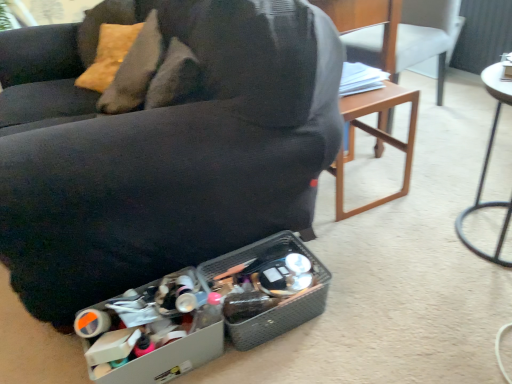
Question: Does metallic silver table at right come behind wooden chair at right, which is counted as the second chair, starting from the left?

Choices:
 (A) yes
 (B) no

Answer: (B)

Question: Is metallic silver table at right not close to wooden chair at right, positioned as the first chair in right-to-left order?

Choices:
 (A) no
 (B) yes

Answer: (A)

Question: Is the depth of metallic silver table at right less than that of wooden chair at right, which is counted as the second chair, starting from the left?

Choices:
 (A) yes
 (B) no

Answer: (A)

Question: Is metallic silver table at right thinner than wooden chair at right, positioned as the first chair in right-to-left order?

Choices:
 (A) no
 (B) yes

Answer: (B)

Question: Does metallic silver table at right have a lesser height compared to wooden chair at right, positioned as the first chair in right-to-left order?

Choices:
 (A) no
 (B) yes

Answer: (B)

Question: From a real-world perspective, is matte black couch at center, placed as the first chair when sorted from left to right, physically located above or below wooden chair at right, positioned as the first chair in right-to-left order?

Choices:
 (A) above
 (B) below

Answer: (A)

Question: From their relative heights in the image, would you say matte black couch at center, placed as the 2th chair when sorted from right to left, is taller or shorter than wooden chair at right, positioned as the first chair in right-to-left order?

Choices:
 (A) tall
 (B) short

Answer: (A)

Question: Considering the positions of point (240, 104) and point (364, 39), is point (240, 104) closer or farther from the camera than point (364, 39)?

Choices:
 (A) closer
 (B) farther

Answer: (A)

Question: Based on their sizes in the image, would you say matte black couch at center, placed as the first chair when sorted from left to right, is bigger or smaller than wooden chair at right, which is counted as the second chair, starting from the left?

Choices:
 (A) small
 (B) big

Answer: (B)

Question: Is wooden chair at right, which is counted as the second chair, starting from the left, taller or shorter than matte black couch at center, placed as the 2th chair when sorted from right to left?

Choices:
 (A) tall
 (B) short

Answer: (B)

Question: In terms of width, does wooden chair at right, which is counted as the second chair, starting from the left, look wider or thinner when compared to matte black couch at center, placed as the first chair when sorted from left to right?

Choices:
 (A) thin
 (B) wide

Answer: (A)

Question: Based on their positions, is wooden chair at right, which is counted as the second chair, starting from the left, located to the left or right of matte black couch at center, placed as the first chair when sorted from left to right?

Choices:
 (A) left
 (B) right

Answer: (B)

Question: Is wooden chair at right, positioned as the first chair in right-to-left order, bigger or smaller than matte black couch at center, placed as the 2th chair when sorted from right to left?

Choices:
 (A) small
 (B) big

Answer: (A)

Question: In the image, is metallic silver table at right positioned in front of or behind matte black couch at center, placed as the first chair when sorted from left to right?

Choices:
 (A) front
 (B) behind

Answer: (B)

Question: Do you think metallic silver table at right is within matte black couch at center, placed as the first chair when sorted from left to right, or outside of it?

Choices:
 (A) outside
 (B) inside

Answer: (A)